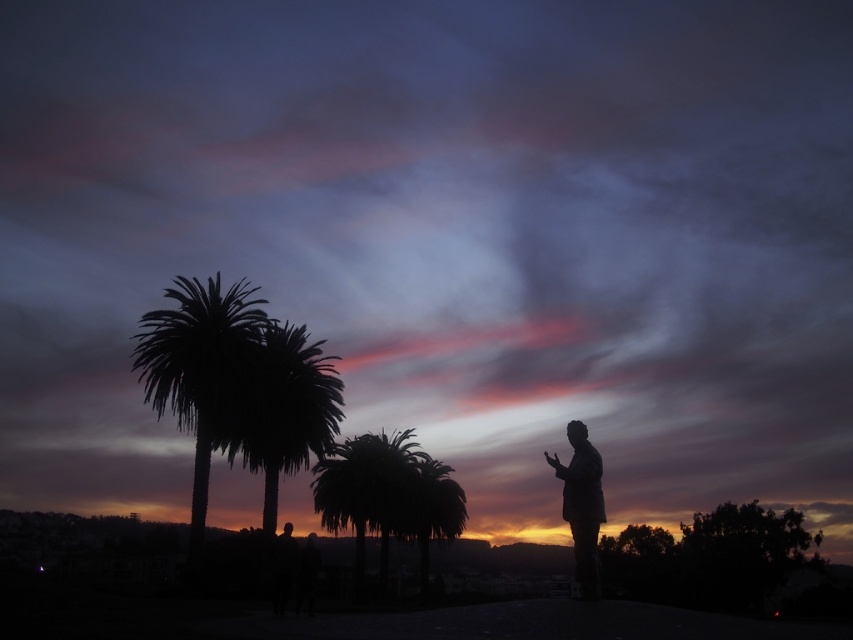
You are a photographer positioned at the left edge of the image. You want to capture both the silhouette palm tree at center and the silhouette statue at right in a single shot. Which direction should you move to ensure both objects are visible in your frame?

Since the silhouette palm tree at center is to the left of the silhouette statue at right, you should move to the left to include both the silhouette palm tree at center and the silhouette statue at right in your frame.

You are planning to place a new bench between the silhouette palm trees at left and the silhouette palm tree at center. The bench is 15 feet long. Will there be enough space between them to fit the bench?

The distance between the silhouette palm trees at left and the silhouette palm tree at center is 14.92 feet, which is slightly less than the 15 feet required for the bench. Therefore, there isn not enough space to fit the bench between them.

You are an artist planning to paint this twilight scene. You want to ensure the proportions between the silhouette palm tree at center and the silhouette statue at right are accurate. Which object should you paint as taller?

The silhouette palm tree at center should be painted as taller than the silhouette statue at right because the description states that the silhouette palm tree at center is taller than the silhouette statue at right.